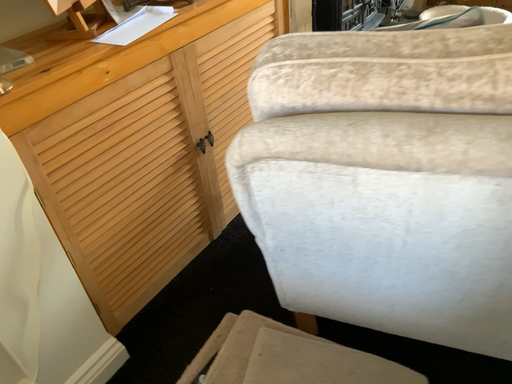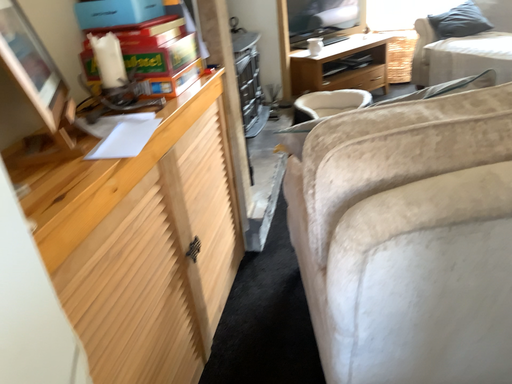
Question: Which way did the camera rotate in the video?

Choices:
 (A) rotated downward
 (B) rotated upward

Answer: (B)